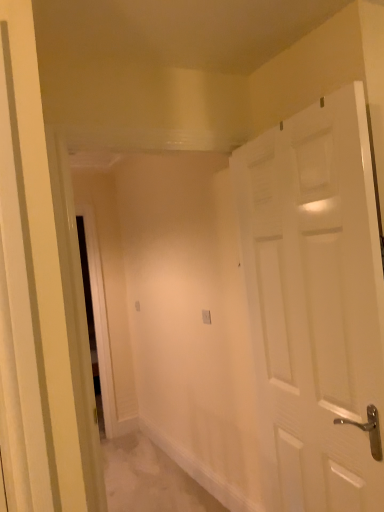
This screenshot has height=512, width=384. What do you see at coordinates (315, 304) in the screenshot?
I see `white matte door at right` at bounding box center [315, 304].

You are a GUI agent. You are given a task and a screenshot of the screen. Output one action in this format:
    pyautogui.click(x=<x>, y=<y>)
    Task: Click on the white matte door at right
    Image resolution: width=384 pixels, height=512 pixels.
    Given the screenshot: What is the action you would take?
    pyautogui.click(x=315, y=304)

The width and height of the screenshot is (384, 512). Describe the element at coordinates (206, 317) in the screenshot. I see `white plastic electric outlet at center` at that location.

What is the approximate height of white plastic electric outlet at center?

3.84 inches.

Where is `white plastic electric outlet at center`? The width and height of the screenshot is (384, 512). white plastic electric outlet at center is located at coordinates (206, 317).

Locate an element on the screen. The height and width of the screenshot is (512, 384). white matte door at right is located at coordinates (315, 304).

Can you confirm if white matte door at right is positioned to the left of white plastic electric outlet at center?

Incorrect, white matte door at right is not on the left side of white plastic electric outlet at center.

Consider the image. In the image, is white matte door at right positioned in front of or behind white plastic electric outlet at center?

white matte door at right is in front of white plastic electric outlet at center.

Is point (309, 429) farther from viewer compared to point (202, 310)?

No.

From the image's perspective, is white matte door at right located above or below white plastic electric outlet at center?

Clearly, from the image's perspective, white matte door at right is above white plastic electric outlet at center.

From a real-world perspective, is white matte door at right physically below white plastic electric outlet at center?

Actually, white matte door at right is physically above white plastic electric outlet at center in the real world.

Considering the sizes of white matte door at right and white plastic electric outlet at center in the image, is white matte door at right wider or thinner than white plastic electric outlet at center?

In the image, white matte door at right appears to be wider than white plastic electric outlet at center.

Considering the relative sizes of white matte door at right and white plastic electric outlet at center in the image provided, is white matte door at right shorter than white plastic electric outlet at center?

Incorrect, the height of white matte door at right does not fall short of that of white plastic electric outlet at center.

Between white matte door at right and white plastic electric outlet at center, which one has smaller size?

Smaller between the two is white plastic electric outlet at center.

Is white matte door at right surrounding white plastic electric outlet at center?

No, white plastic electric outlet at center is not inside white matte door at right.

Is white matte door at right beside white plastic electric outlet at center?

white matte door at right and white plastic electric outlet at center are clearly separated.

Is white matte door at right turned away from white plastic electric outlet at center?

No, white matte door at right is not facing the opposite direction of white plastic electric outlet at center.

How many degrees apart are the facing directions of white matte door at right and white plastic electric outlet at center?

There is a 8.43-degree angle between the facing directions of white matte door at right and white plastic electric outlet at center.

You are a GUI agent. You are given a task and a screenshot of the screen. Output one action in this format:
    pyautogui.click(x=<x>, y=<y>)
    Task: Click on the door that appears above the white plastic electric outlet at center (from the image's perspective)
    
    Given the screenshot: What is the action you would take?
    pyautogui.click(x=315, y=304)

Considering the relative positions of white plastic electric outlet at center and white matte door at right in the image provided, is white plastic electric outlet at center to the left of white matte door at right from the viewer's perspective?

Correct, you'll find white plastic electric outlet at center to the left of white matte door at right.

Is white plastic electric outlet at center positioned in front of white matte door at right?

No.

Which is farther, (209, 323) or (245, 179)?

The point (209, 323) is farther from the camera.

From the image's perspective, which one is positioned higher, white plastic electric outlet at center or white matte door at right?

white matte door at right is shown above in the image.

From a real-world perspective, who is located lower, white plastic electric outlet at center or white matte door at right?

white plastic electric outlet at center is physically lower.

Which object is wider, white plastic electric outlet at center or white matte door at right?

With larger width is white matte door at right.

Consider the image. From their relative heights in the image, would you say white plastic electric outlet at center is taller or shorter than white matte door at right?

Considering their sizes, white plastic electric outlet at center has less height than white matte door at right.

Considering the sizes of white plastic electric outlet at center and white matte door at right in the image, is white plastic electric outlet at center bigger or smaller than white matte door at right?

Clearly, white plastic electric outlet at center is smaller in size than white matte door at right.

Is white plastic electric outlet at center located outside white matte door at right?

Yes, white plastic electric outlet at center is not within white matte door at right.

Would you say white plastic electric outlet at center is a long distance from white matte door at right?

Yes, white plastic electric outlet at center and white matte door at right are located far from each other.

Is white plastic electric outlet at center looking in the opposite direction of white matte door at right?

No, white plastic electric outlet at center is not facing away from white matte door at right.

How many degrees apart are the facing directions of white plastic electric outlet at center and white matte door at right?

The angle between the facing direction of white plastic electric outlet at center and the facing direction of white matte door at right is 8.43 degrees.

This screenshot has width=384, height=512. In order to click on door that is on the right side of white plastic electric outlet at center in this screenshot , I will do [315, 304].

This screenshot has height=512, width=384. What are the coordinates of `door lying on the right of white plastic electric outlet at center` in the screenshot? It's located at (315, 304).

Locate an element on the screen. electric outlet that is behind the white matte door at right is located at coordinates (206, 317).